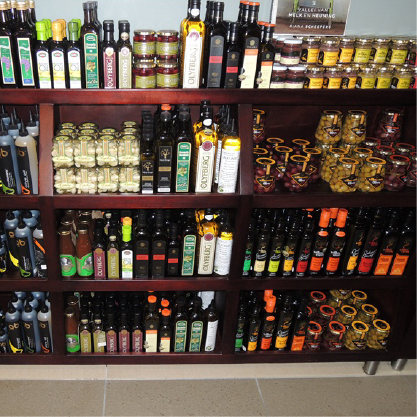
This screenshot has height=417, width=417. Find the location of `wall`. wall is located at coordinates click(x=139, y=12).